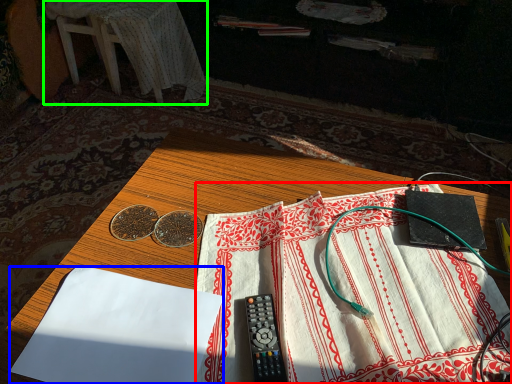
Question: Based on their relative distances, which object is farther from sheet (highlighted by a red box)? Choose from sheet (highlighted by a blue box) and furniture (highlighted by a green box).

Choices:
 (A) sheet
 (B) furniture

Answer: (B)